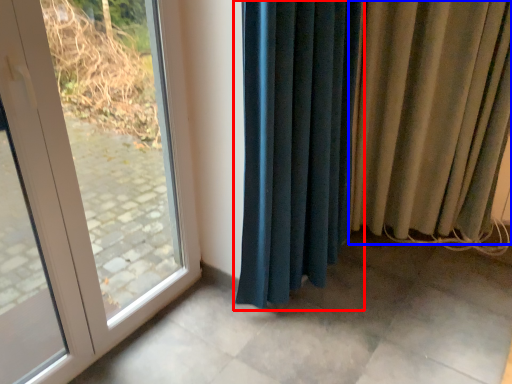
Question: Which point is further to the camera, curtain (highlighted by a red box) or curtain (highlighted by a blue box)?

Choices:
 (A) curtain
 (B) curtain

Answer: (B)